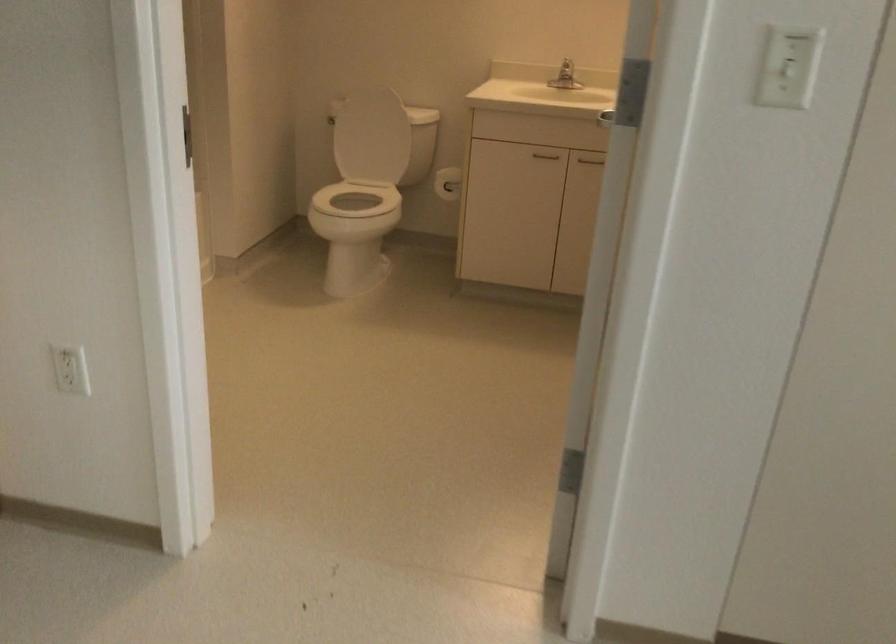
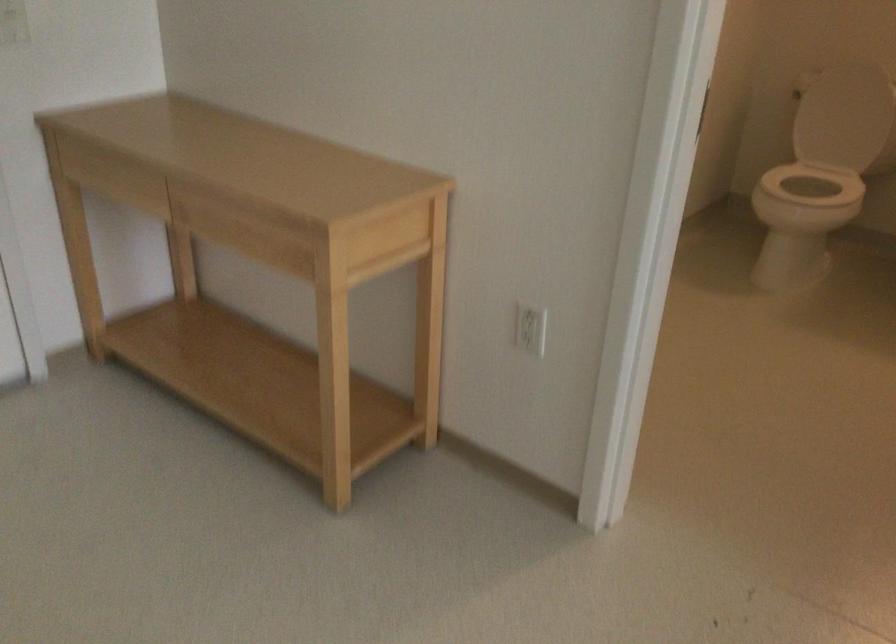
In the second image, find the point that corresponds to (346,205) in the first image.

(814, 184)